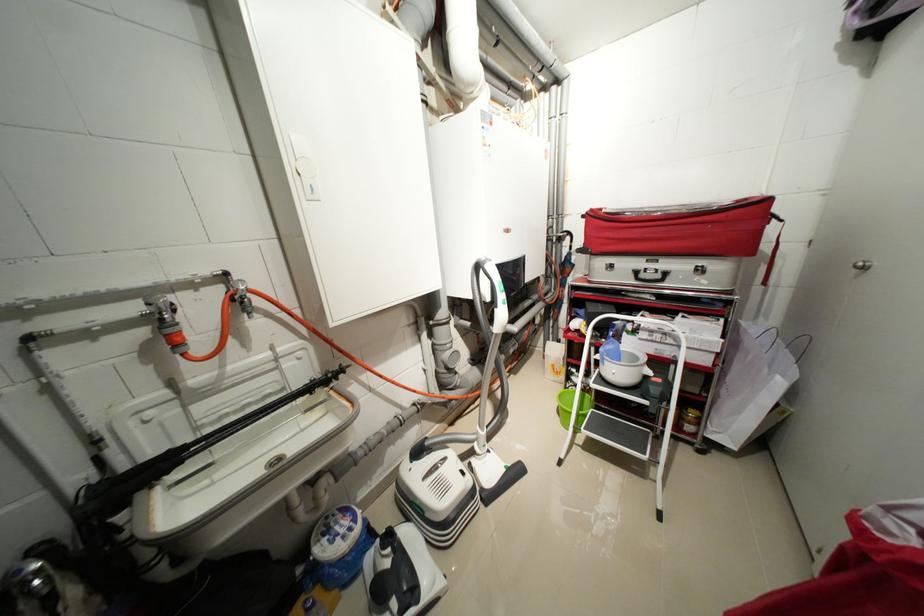
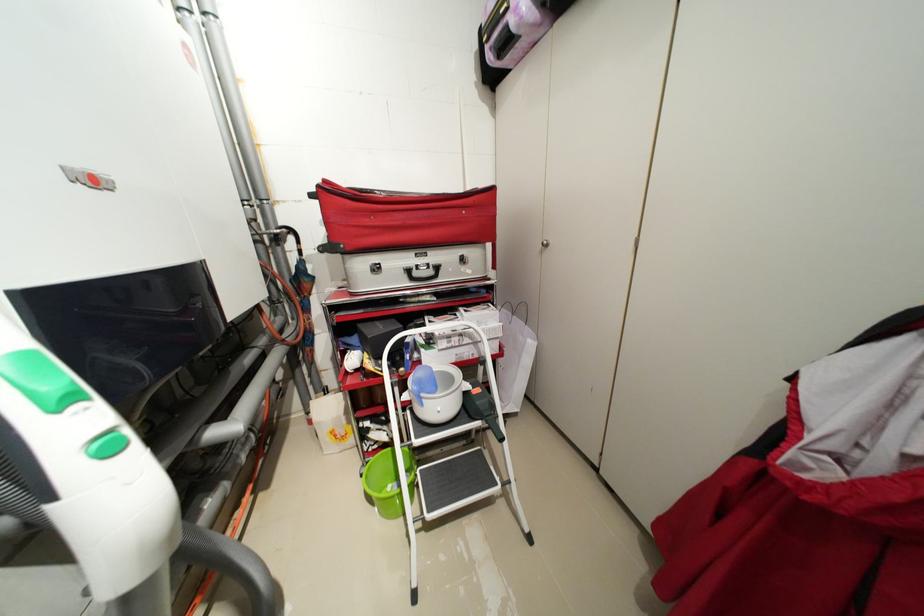
In the second image, find the point that corresponds to (715,367) in the first image.

(505, 352)